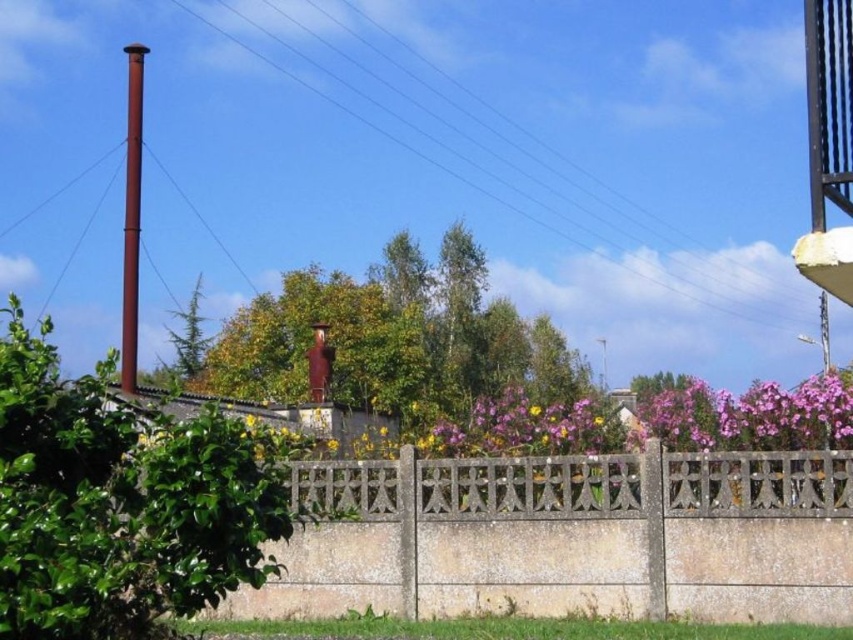
You are standing in the outdoor scene and want to walk from point A to point B. Point A is at coordinate point [827,502] and point B is at coordinate point [648,212]. Given the presence of the concrete wall with a decorative metal fence, will you be able to walk directly from point A to point B without crossing the wall or fence?

Point [827,502] is in front of point [648,212], so you can walk directly from point [827,502] to point [648,212] without crossing the wall or fence since the starting point is closer to the viewer than the destination point.

You are a drone operator trying to position your drone at the exact coordinates given in the scene description. What are the coordinates of the metallic wire at upper center?

The coordinates of the metallic wire at upper center are at point (477, 182).